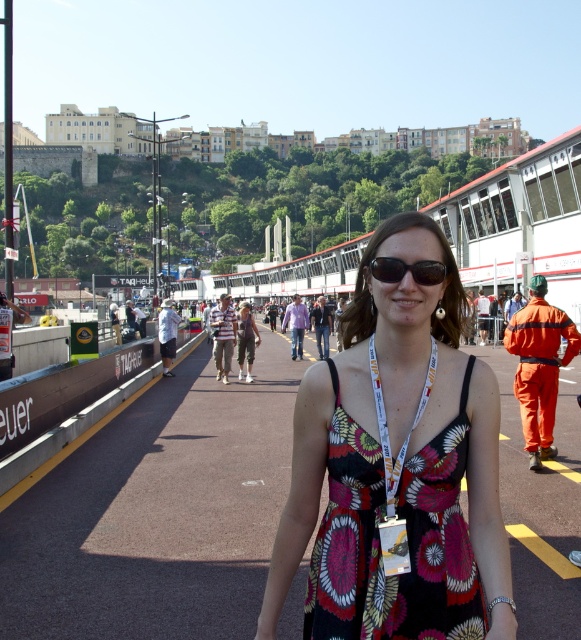
Is black asphalt at center bigger than black plastic sunglasses at center?

Yes.

Does black asphalt at center have a lesser height compared to black plastic sunglasses at center?

In fact, black asphalt at center may be taller than black plastic sunglasses at center.

The image size is (581, 640). What do you see at coordinates (157, 513) in the screenshot?
I see `black asphalt at center` at bounding box center [157, 513].

The height and width of the screenshot is (640, 581). Identify the location of black asphalt at center. (157, 513).

What do you see at coordinates (393, 467) in the screenshot?
I see `floral dress at center` at bounding box center [393, 467].

Is floral dress at center further to camera compared to black plastic sunglasses at center?

No, floral dress at center is in front of black plastic sunglasses at center.

Find the location of a particular element. This screenshot has width=581, height=640. floral dress at center is located at coordinates (393, 467).

Does black asphalt at center have a greater width compared to floral dress at center?

Yes.

Which is behind, point (66, 520) or point (425, 230)?

Positioned behind is point (66, 520).

Which is behind, point (5, 608) or point (370, 428)?

Point (5, 608)

I want to click on black asphalt at center, so click(157, 513).